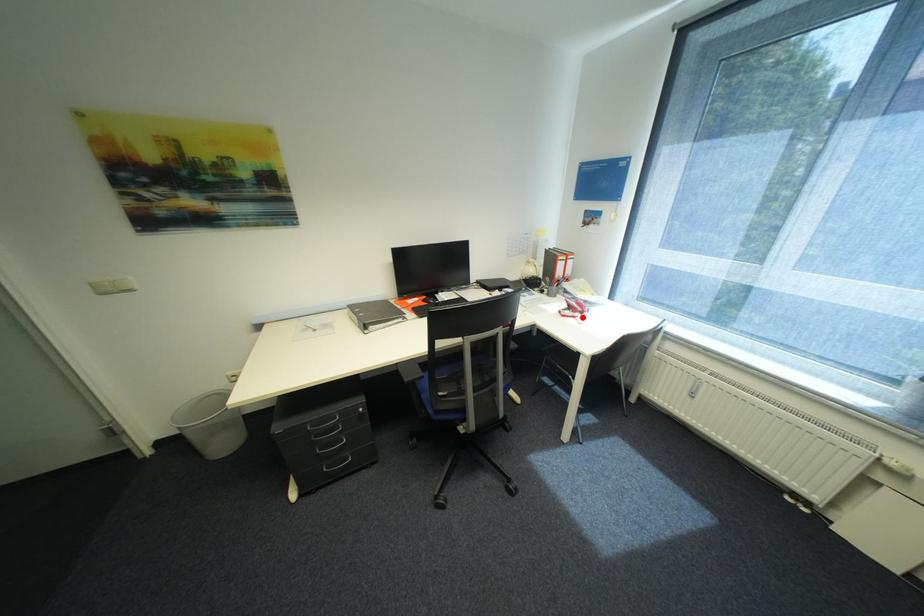
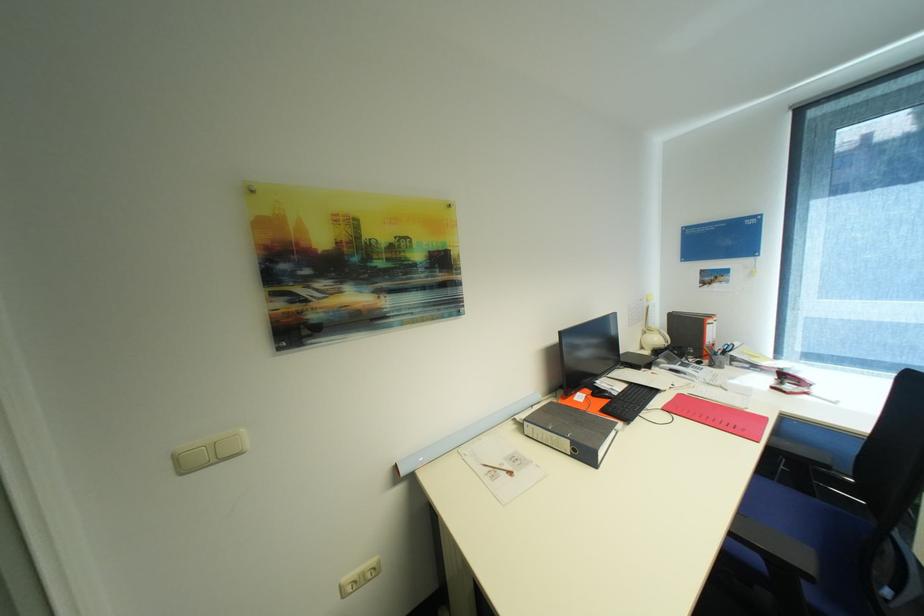
Locate, in the second image, the point that corresponds to the highlighted location in the first image.

(813, 394)